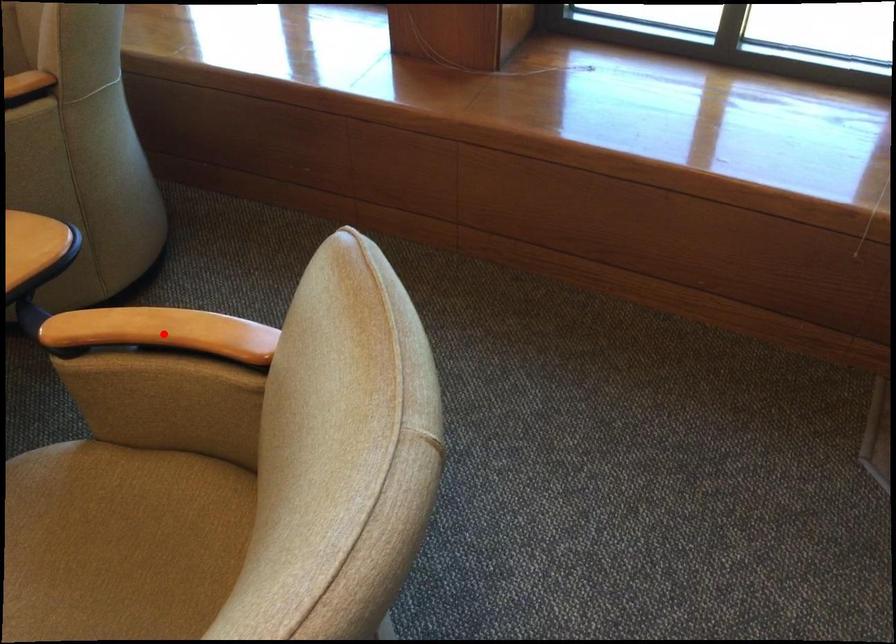
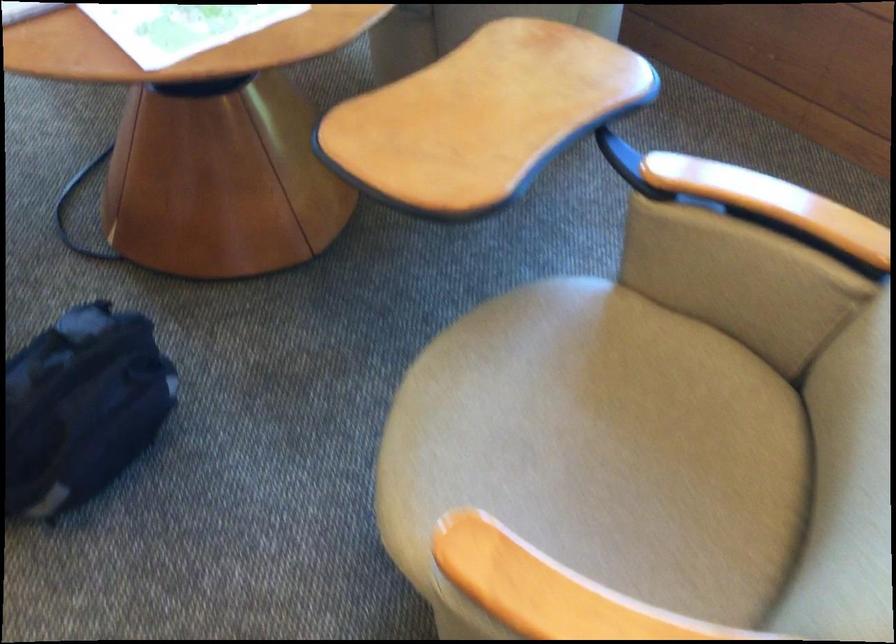
In the second image, find the point that corresponds to the highlighted location in the first image.

(771, 202)